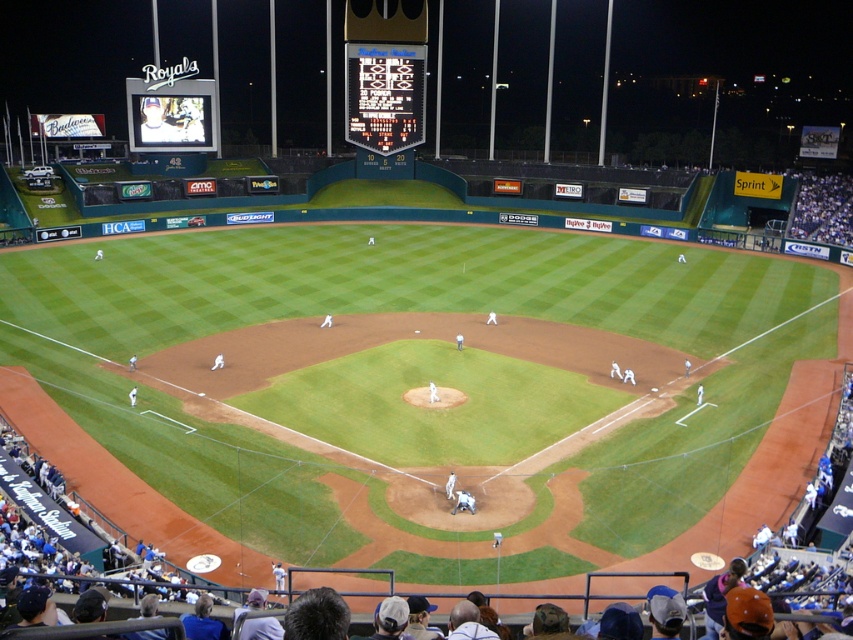
You are a photographer at Kauffman Stadium and want to take a photo of the matte black scoreboard at upper left without the black digital scoreboard at upper center blocking it. What should you do?

Move to a position where the matte black scoreboard at upper left is no longer behind the black digital scoreboard at upper center. Since the matte black scoreboard at upper left is behind the black digital scoreboard at upper center, adjusting your angle or moving to a different vantage point would allow you to capture the matte black scoreboard at upper left without obstruction.

You are a drone operator trying to capture aerial footage of the baseball game. You have two points marked on your map for camera positioning. The first point is at coordinates point [374,131] and the second point is at coordinates point [142,125]. From the perspective of the stadium, which point would allow the camera to have a better view of the scoreboard located at the back center of the field?

Point [374,131] is behind point [142,125], so the camera positioned at point [374,131] would be further back and thus have a better view of the scoreboard located at the back center of the field.

You are a photographer at Kauffman Stadium trying to capture a wide shot of the field. You notice the black digital scoreboard at upper center and the matte black scoreboard at upper left. Which scoreboard takes up more space in the frame?

The matte black scoreboard at upper left takes up more space in the frame because the black digital scoreboard at upper center occupies less space than matte black scoreboard at upper left.